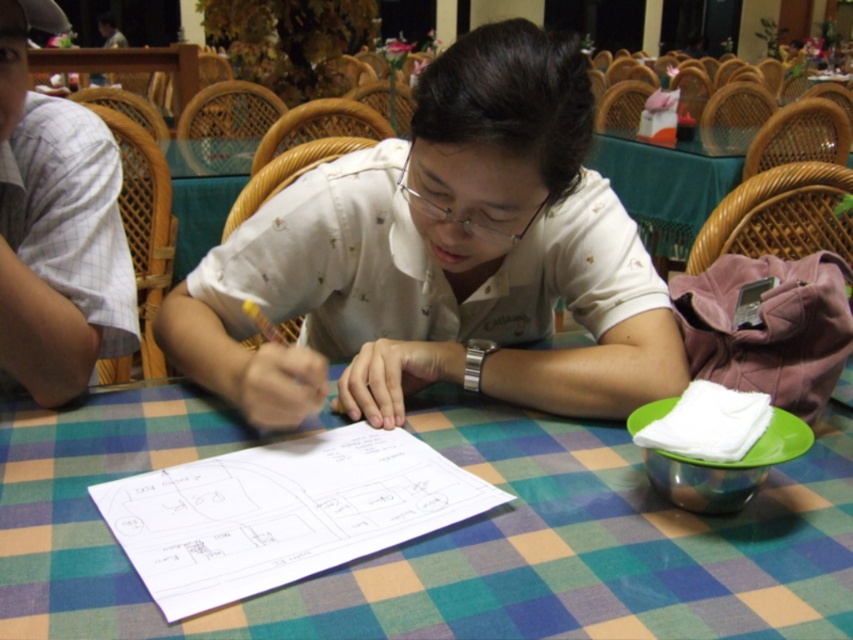
Question: Is green checkered tablecloth at center below clear plastic glasses at center?

Choices:
 (A) yes
 (B) no

Answer: (A)

Question: Which point is farther to the camera?

Choices:
 (A) green checkered tablecloth at center
 (B) clear plastic glasses at center

Answer: (B)

Question: Can you confirm if green checkered tablecloth at center is positioned to the left of white paper at center?

Choices:
 (A) yes
 (B) no

Answer: (B)

Question: Is white matte shirt at center thinner than clear plastic glasses at center?

Choices:
 (A) yes
 (B) no

Answer: (B)

Question: Which point is farther to the camera?

Choices:
 (A) white paper at center
 (B) white matte shirt at center
 (C) white checkered shirt at left
 (D) green checkered tablecloth at center

Answer: (C)

Question: Which is farther from the green checkered tablecloth at center?

Choices:
 (A) clear plastic glasses at center
 (B) white paper at center
 (C) white checkered shirt at left
 (D) white matte shirt at center

Answer: (A)